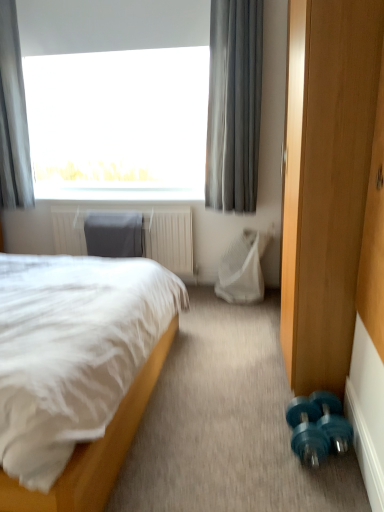
Find the location of a particular element. Image resolution: width=384 pixels, height=512 pixels. vacant area in front of teal rubber dumbbell at lower right is located at coordinates (330, 486).